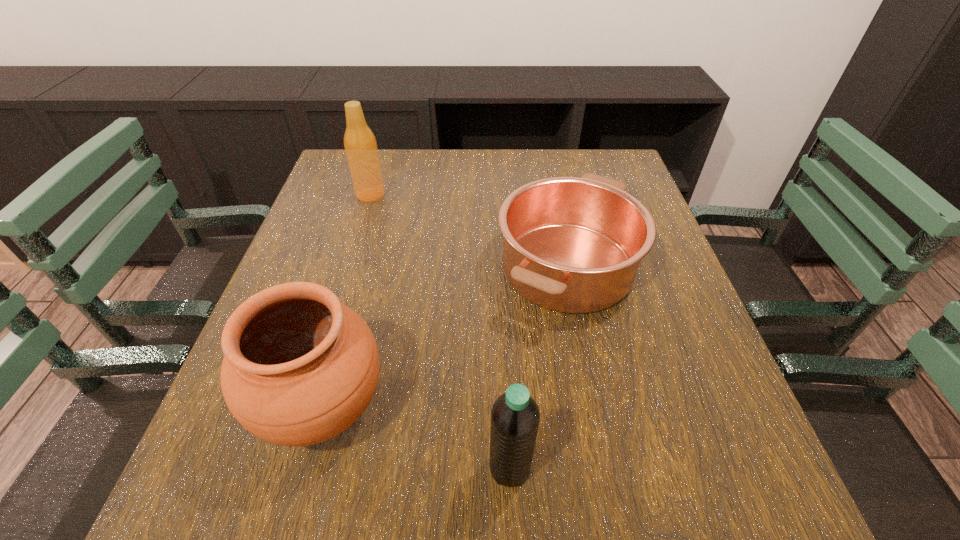
This screenshot has height=540, width=960. Identify the location of beer bottle. (360, 144).

Locate an element on the screen. This screenshot has height=540, width=960. pottery is located at coordinates (299, 367).

Find the location of a particular element. Image resolution: width=960 pixels, height=540 pixels. water bottle is located at coordinates (515, 416).

You are a GUI agent. You are given a task and a screenshot of the screen. Output one action in this format:
    pyautogui.click(x=<x>, y=<y>)
    Task: Click on the third nearest object
    This screenshot has height=540, width=960.
    Given the screenshot: What is the action you would take?
    pyautogui.click(x=574, y=245)

Identify the location of saucepan. Image resolution: width=960 pixels, height=540 pixels. (574, 245).

At what (x,y) coordinates should I click in order to perform the action: click on free region located on the back of the beer bottle. Please return your answer as a coordinate pair (x, y). Image resolution: width=960 pixels, height=540 pixels. Looking at the image, I should click on (381, 159).

The height and width of the screenshot is (540, 960). In order to click on vacant area situated on the right of the pottery in this screenshot , I will do `click(601, 407)`.

You are a GUI agent. You are given a task and a screenshot of the screen. Output one action in this format:
    pyautogui.click(x=<x>, y=<y>)
    Task: Click on the vacant space located on the back of the water bottle
    
    Given the screenshot: What is the action you would take?
    pyautogui.click(x=503, y=326)

Where is `vacant space positioned 0.250m on the back of the third nearest object`? The height and width of the screenshot is (540, 960). vacant space positioned 0.250m on the back of the third nearest object is located at coordinates (x=546, y=161).

Identify the location of object that is at the far edge. (360, 144).